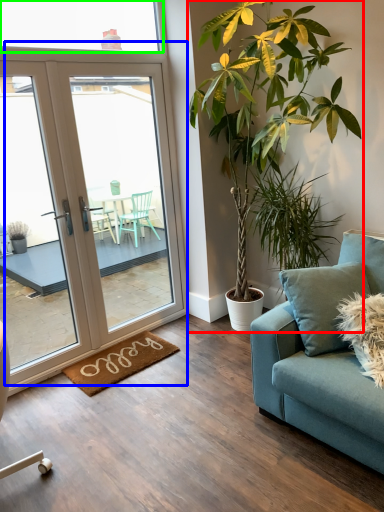
Question: Based on their relative distances, which object is farther from houseplant (highlighted by a red box)? Choose from door (highlighted by a blue box) and window (highlighted by a green box).

Choices:
 (A) door
 (B) window

Answer: (B)